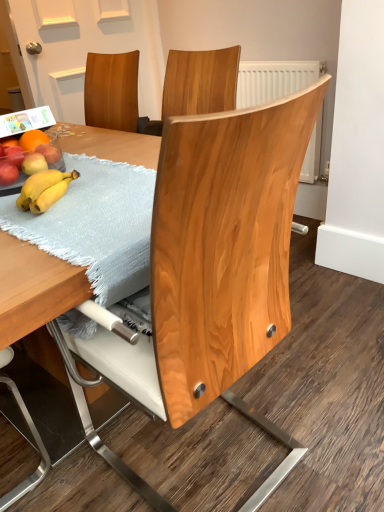
Where is `free space on the front side of matte red apple at left, acting as the 1th apple starting from the front`? The image size is (384, 512). free space on the front side of matte red apple at left, acting as the 1th apple starting from the front is located at coordinates (24, 206).